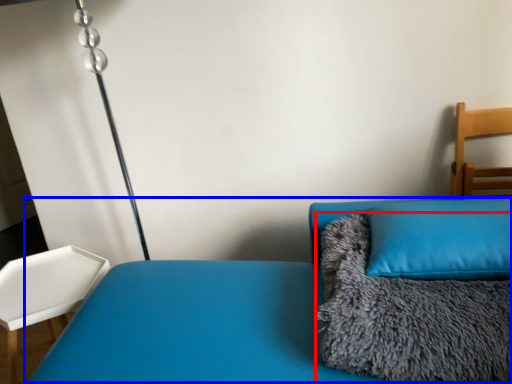
Question: Which point is further to the camera, blanket (highlighted by a red box) or couch (highlighted by a blue box)?

Choices:
 (A) blanket
 (B) couch

Answer: (A)